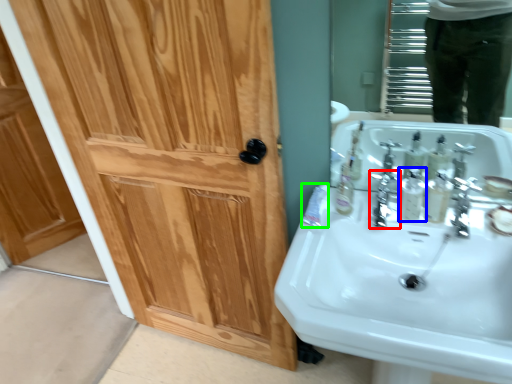
Question: Which object is the farthest from plumbing fixture (highlighted by a red box)? Choose among these: mouthwash (highlighted by a blue box) or toothpaste (highlighted by a green box).

Choices:
 (A) mouthwash
 (B) toothpaste

Answer: (B)